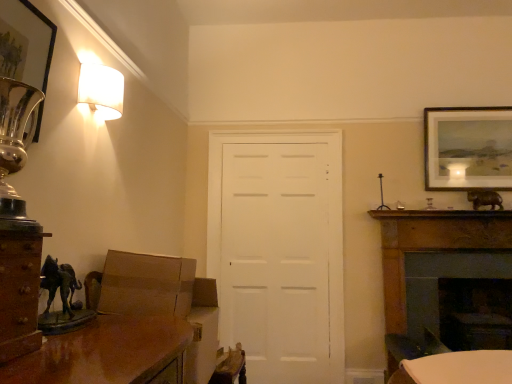
What is the approximate width of metallic silver picture frame at upper left, acting as the 1th picture frame starting from the left?

It is 3.57 inches.

Image resolution: width=512 pixels, height=384 pixels. What do you see at coordinates (279, 251) in the screenshot?
I see `white matte door at center` at bounding box center [279, 251].

Image resolution: width=512 pixels, height=384 pixels. Identify the location of dark wood fireplace at lower right, marked as the second fireplace in a front-to-back arrangement. (444, 277).

The width and height of the screenshot is (512, 384). Describe the element at coordinates (101, 90) in the screenshot. I see `white fabric lampshade at upper left` at that location.

You are a GUI agent. You are given a task and a screenshot of the screen. Output one action in this format:
    pyautogui.click(x=<x>, y=<y>)
    Task: Click on the matte gold picture frame at upper right, the second picture frame from the left
    
    Given the screenshot: What is the action you would take?
    pyautogui.click(x=468, y=148)

Can you confirm if white fabric lampshade at upper left is smaller than metallic silver picture frame at upper left, acting as the 2th picture frame starting from the right?

Correct, white fabric lampshade at upper left occupies less space than metallic silver picture frame at upper left, acting as the 2th picture frame starting from the right.

From a real-world perspective, is white fabric lampshade at upper left under metallic silver picture frame at upper left, acting as the 2th picture frame starting from the right?

No.

Is white fabric lampshade at upper left at the left side of metallic silver picture frame at upper left, acting as the 2th picture frame starting from the right?

No, white fabric lampshade at upper left is not to the left of metallic silver picture frame at upper left, acting as the 2th picture frame starting from the right.

Is white fabric lampshade at upper left next to metallic silver picture frame at upper left, acting as the 1th picture frame starting from the left, and touching it?

No, white fabric lampshade at upper left is not beside metallic silver picture frame at upper left, acting as the 1th picture frame starting from the left.

Which is in front, point (426, 320) or point (502, 175)?

Positioned in front is point (426, 320).

Considering the sizes of dark wood fireplace at lower right, arranged as the 1th fireplace when viewed from the back, and matte gold picture frame at upper right, the second picture frame positioned from the front, in the image, is dark wood fireplace at lower right, arranged as the 1th fireplace when viewed from the back, taller or shorter than matte gold picture frame at upper right, the second picture frame positioned from the front,?

Considering their sizes, dark wood fireplace at lower right, arranged as the 1th fireplace when viewed from the back, has more height than matte gold picture frame at upper right, the second picture frame positioned from the front.

Is dark wood fireplace at lower right, marked as the second fireplace in a front-to-back arrangement, wider than matte gold picture frame at upper right, the second picture frame positioned from the front?

Yes, dark wood fireplace at lower right, marked as the second fireplace in a front-to-back arrangement, is wider than matte gold picture frame at upper right, the second picture frame positioned from the front.

From the image's perspective, which is below, white fabric lampshade at upper left or dark wood fireplace at right, acting as the 2th fireplace starting from the back?

dark wood fireplace at right, acting as the 2th fireplace starting from the back.

In terms of height, does white fabric lampshade at upper left look taller or shorter compared to dark wood fireplace at right, which is counted as the 1th fireplace, starting from the front?

Clearly, white fabric lampshade at upper left is shorter compared to dark wood fireplace at right, which is counted as the 1th fireplace, starting from the front.

Which point is more distant from viewer, (91, 104) or (419, 245)?

The point (419, 245) is more distant.

Does point (2, 59) appear closer or farther from the camera than point (236, 178)?

Clearly, point (2, 59) is closer to the camera than point (236, 178).

You are a GUI agent. You are given a task and a screenshot of the screen. Output one action in this format:
    pyautogui.click(x=<x>, y=<y>)
    Task: Click on the door below the metallic silver picture frame at upper left, the second picture frame when ordered from back to front (from the image's perspective)
    The width and height of the screenshot is (512, 384).
    Given the screenshot: What is the action you would take?
    pos(279,251)

Looking at the image, does metallic silver picture frame at upper left, placed as the first picture frame when sorted from front to back, seem bigger or smaller compared to white matte door at center?

Clearly, metallic silver picture frame at upper left, placed as the first picture frame when sorted from front to back, is smaller in size than white matte door at center.

How many degrees apart are the facing directions of metallic silver picture frame at upper left, acting as the 2th picture frame starting from the right, and white matte door at center?

The angular difference between metallic silver picture frame at upper left, acting as the 2th picture frame starting from the right, and white matte door at center is 86.5 degrees.

Is white fabric lampshade at upper left facing away from white glossy table at lower right?

No, white fabric lampshade at upper left's orientation is not away from white glossy table at lower right.

Can you confirm if white fabric lampshade at upper left is thinner than white glossy table at lower right?

Correct, the width of white fabric lampshade at upper left is less than that of white glossy table at lower right.

Can you confirm if white fabric lampshade at upper left is bigger than white glossy table at lower right?

No, white fabric lampshade at upper left is not bigger than white glossy table at lower right.

Is white fabric lampshade at upper left at the right side of white glossy table at lower right?

In fact, white fabric lampshade at upper left is to the left of white glossy table at lower right.

Is point (437, 227) behind point (466, 371)?

Yes.

Is dark wood fireplace at right, which is counted as the 1th fireplace, starting from the front, next to white glossy table at lower right and touching it?

dark wood fireplace at right, which is counted as the 1th fireplace, starting from the front, and white glossy table at lower right are clearly separated.

From a real-world perspective, is dark wood fireplace at right, acting as the 2th fireplace starting from the back, located higher than white glossy table at lower right?

Yes, from a real-world perspective, dark wood fireplace at right, acting as the 2th fireplace starting from the back, is on top of white glossy table at lower right.

Is dark wood fireplace at right, acting as the 2th fireplace starting from the back, in front of white glossy table at lower right?

No.

Is matte gold picture frame at upper right, the first picture frame viewed from the back, bigger or smaller than brown wood cabinet at left?

Considering their sizes, matte gold picture frame at upper right, the first picture frame viewed from the back, takes up more space than brown wood cabinet at left.

Is matte gold picture frame at upper right, the second picture frame from the left, not within brown wood cabinet at left?

Indeed, matte gold picture frame at upper right, the second picture frame from the left, is completely outside brown wood cabinet at left.

From a real-world perspective, who is located higher, matte gold picture frame at upper right, the second picture frame positioned from the front, or brown wood cabinet at left?

matte gold picture frame at upper right, the second picture frame positioned from the front, from a real-world perspective.

Could you tell me if matte gold picture frame at upper right, the first picture frame viewed from the back, is turned towards brown wood cabinet at left?

No, matte gold picture frame at upper right, the first picture frame viewed from the back, is not turned towards brown wood cabinet at left.

You are a GUI agent. You are given a task and a screenshot of the screen. Output one action in this format:
    pyautogui.click(x=<x>, y=<y>)
    Task: Click on the picture frame on the left of white fabric lampshade at upper left
    This screenshot has height=384, width=512.
    Given the screenshot: What is the action you would take?
    pyautogui.click(x=25, y=43)

You are a GUI agent. You are given a task and a screenshot of the screen. Output one action in this format:
    pyautogui.click(x=<x>, y=<y>)
    Task: Click on the picture frame behind the dark wood fireplace at lower right, arranged as the 1th fireplace when viewed from the back
    
    Given the screenshot: What is the action you would take?
    pyautogui.click(x=468, y=148)

Estimate the real-world distances between objects in this image. Which object is further from metallic silver picture frame at upper left, acting as the 1th picture frame starting from the left, white matte door at center or white glossy table at lower right?

white matte door at center is positioned further to the anchor metallic silver picture frame at upper left, acting as the 1th picture frame starting from the left.

From the picture: Estimate the real-world distances between objects in this image. Which object is closer to dark wood fireplace at lower right, marked as the second fireplace in a front-to-back arrangement, dark wood fireplace at right, which is counted as the 1th fireplace, starting from the front, or white fabric lampshade at upper left?

Based on the image, dark wood fireplace at right, which is counted as the 1th fireplace, starting from the front, appears to be nearer to dark wood fireplace at lower right, marked as the second fireplace in a front-to-back arrangement.

Which object lies nearer to the anchor point white matte door at center, metallic silver picture frame at upper left, placed as the first picture frame when sorted from front to back, or white glossy table at lower right?

white glossy table at lower right.

When comparing their distances from dark wood fireplace at right, which is counted as the 1th fireplace, starting from the front, does white matte door at center or matte gold picture frame at upper right, the second picture frame positioned from the front, seem further?

white matte door at center lies further to dark wood fireplace at right, which is counted as the 1th fireplace, starting from the front, than the other object.

When comparing their distances from matte gold picture frame at upper right, the second picture frame positioned from the front, does dark wood fireplace at right, acting as the 2th fireplace starting from the back, or metallic silver picture frame at upper left, acting as the 1th picture frame starting from the left, seem further?

metallic silver picture frame at upper left, acting as the 1th picture frame starting from the left, is positioned further to the anchor matte gold picture frame at upper right, the second picture frame positioned from the front.

From the image, which object appears to be nearer to white glossy table at lower right, brown wood cabinet at left or white matte door at center?

brown wood cabinet at left is positioned closer to the anchor white glossy table at lower right.

When comparing their distances from dark wood fireplace at right, acting as the 2th fireplace starting from the back, does white glossy table at lower right or brown wood cabinet at left seem closer?

white glossy table at lower right is positioned closer to the anchor dark wood fireplace at right, acting as the 2th fireplace starting from the back.

Which object lies nearer to the anchor point metallic silver picture frame at upper left, acting as the 2th picture frame starting from the right, brown wood cabinet at left or matte gold picture frame at upper right, the second picture frame positioned from the front?

brown wood cabinet at left lies closer to metallic silver picture frame at upper left, acting as the 2th picture frame starting from the right, than the other object.

Identify the location of table positioned between brown wood cabinet at left and white matte door at center from near to far. This screenshot has width=512, height=384. (457, 368).

Find the location of a particular element. fireplace situated between brown wood cabinet at left and matte gold picture frame at upper right, the first picture frame viewed from the back, from left to right is located at coordinates (436, 260).

Where is `lamp situated between brown wood cabinet at left and white glossy table at lower right from left to right`? The height and width of the screenshot is (384, 512). lamp situated between brown wood cabinet at left and white glossy table at lower right from left to right is located at coordinates (101, 90).

Identify the location of table located between brown wood cabinet at left and dark wood fireplace at lower right, marked as the second fireplace in a front-to-back arrangement, in the left-right direction. (457, 368).